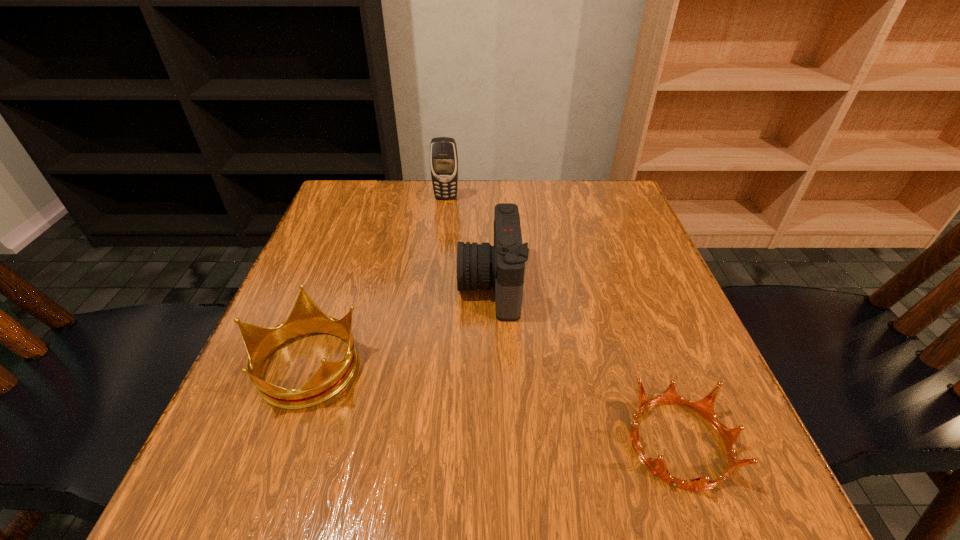
Locate an element on the screen. The image size is (960, 540). vacant space positioned 0.310m at the lens of the second farthest object is located at coordinates (311, 285).

Identify the location of vacant area located at the lens of the second farthest object. (x=416, y=285).

This screenshot has height=540, width=960. I want to click on free space located 0.310m on the right of the leftmost object, so click(539, 365).

Find the location of a particular element. The width and height of the screenshot is (960, 540). free space located on the left of the rightmost object is located at coordinates (432, 443).

Locate an element on the screen. The height and width of the screenshot is (540, 960). object that is at the far edge is located at coordinates (443, 151).

The height and width of the screenshot is (540, 960). I want to click on object that is at the near edge, so click(x=705, y=407).

Locate an element on the screen. This screenshot has height=540, width=960. object situated at the left edge is located at coordinates (306, 317).

Where is `object that is at the right edge`? The image size is (960, 540). object that is at the right edge is located at coordinates (705, 407).

Identify the location of object that is at the near right corner. This screenshot has width=960, height=540. click(705, 407).

Where is `free spot at the far edge of the desktop`? free spot at the far edge of the desktop is located at coordinates (468, 186).